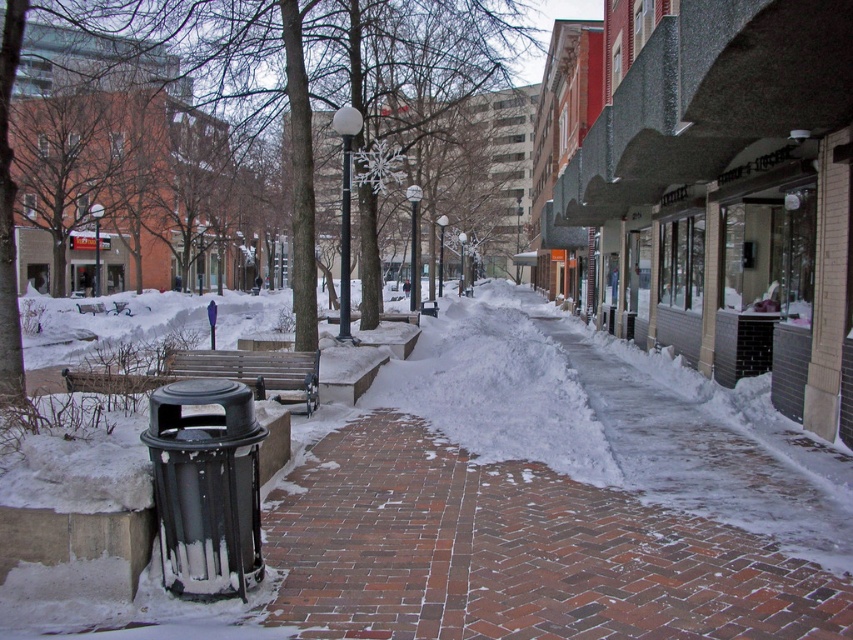
Question: Which point appears closest to the camera in this image?

Choices:
 (A) (68, 378)
 (B) (642, 536)

Answer: (B)

Question: Among these points, which one is nearest to the camera?

Choices:
 (A) (593, 621)
 (B) (148, 388)

Answer: (A)

Question: Can you confirm if brick pavement at center is wider than wooden bench at center?

Choices:
 (A) no
 (B) yes

Answer: (B)

Question: Considering the relative positions of brick pavement at center and wooden bench at center in the image provided, where is brick pavement at center located with respect to wooden bench at center?

Choices:
 (A) right
 (B) left

Answer: (A)

Question: Is brick pavement at center behind wooden bench at center?

Choices:
 (A) yes
 (B) no

Answer: (B)